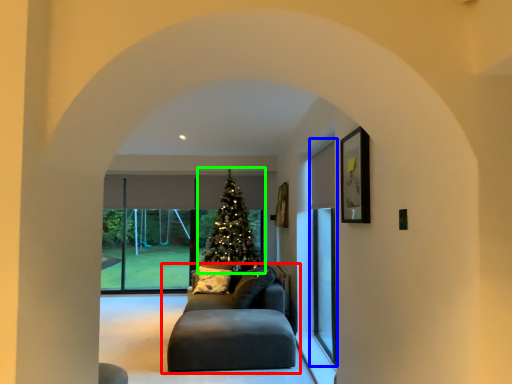
Question: Which object is the farthest from studio couch (highlighted by a red box)? Choose among these: screen door (highlighted by a blue box) or christmas tree (highlighted by a green box).

Choices:
 (A) screen door
 (B) christmas tree

Answer: (B)